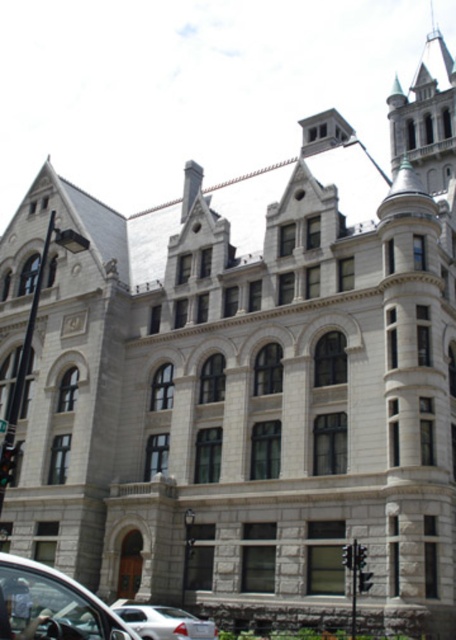
Does metallic silver car at lower left come in front of red plastic traffic light at center?

That is True.

Which is behind, point (62, 636) or point (358, 561)?

Point (358, 561)

Describe the element at coordinates (53, 604) in the screenshot. I see `metallic silver car at lower left` at that location.

Where is `metallic silver car at lower left`? This screenshot has height=640, width=456. metallic silver car at lower left is located at coordinates (53, 604).

Does white matte car at lower left have a greater width compared to red glass traffic light at center?

Indeed, white matte car at lower left has a greater width compared to red glass traffic light at center.

Is point (207, 624) positioned before point (352, 552)?

Yes, point (207, 624) is closer to viewer.

Is point (216, 636) behind point (352, 545)?

No.

Identify the location of white matte car at lower left. Image resolution: width=456 pixels, height=640 pixels. (164, 621).

Between point (5, 477) and point (342, 563), which one is positioned in front?

Point (5, 477) is in front.

Does metallic traffic light at lower left have a greater width compared to red glass traffic light at center?

Yes.

Between point (0, 460) and point (348, 561), which one is positioned in front?

Point (0, 460) is in front.

Where is `metallic traffic light at lower left`? Image resolution: width=456 pixels, height=640 pixels. metallic traffic light at lower left is located at coordinates (6, 465).